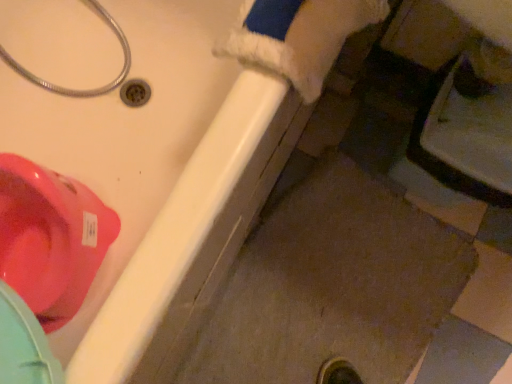
The height and width of the screenshot is (384, 512). Describe the element at coordinates (50, 238) in the screenshot. I see `glossy plastic toilet at upper left` at that location.

Find the location of a particular element. The width and height of the screenshot is (512, 384). matte white bathtub at lower left is located at coordinates (185, 240).

At what (x,y) coordinates should I click in order to perform the action: click on plumbing fixture in front of the glossy plastic toilet at upper left. Please return your answer as a coordinate pair (x, y). The width and height of the screenshot is (512, 384). Looking at the image, I should click on (80, 89).

How many degrees apart are the facing directions of glossy plastic toilet at upper left and metallic silver hose at upper left?

There is a 90.9-degree angle between the facing directions of glossy plastic toilet at upper left and metallic silver hose at upper left.

Looking at their sizes, would you say glossy plastic toilet at upper left is wider or thinner than metallic silver hose at upper left?

In the image, glossy plastic toilet at upper left appears to be more narrow than metallic silver hose at upper left.

Is glossy plastic toilet at upper left taller than metallic silver hose at upper left?

No, glossy plastic toilet at upper left is not taller than metallic silver hose at upper left.

Which object is more forward, matte white bathtub at lower left or glossy plastic toilet at upper left?

matte white bathtub at lower left is closer to the camera.

Does matte white bathtub at lower left turn towards glossy plastic toilet at upper left?

Yes, matte white bathtub at lower left is aimed at glossy plastic toilet at upper left.

Which is correct: matte white bathtub at lower left is inside glossy plastic toilet at upper left, or outside of it?

matte white bathtub at lower left is located beyond the bounds of glossy plastic toilet at upper left.

Which object is closer to the camera taking this photo, matte white bathtub at lower left or metallic silver hose at upper left?

Positioned in front is matte white bathtub at lower left.

I want to click on plumbing fixture above the matte white bathtub at lower left (from a real-world perspective), so click(x=80, y=89).

Is matte white bathtub at lower left located outside metallic silver hose at upper left?

Yes, matte white bathtub at lower left is not within metallic silver hose at upper left.

Does metallic silver hose at upper left have a larger size compared to glossy plastic toilet at upper left?

Yes, metallic silver hose at upper left is bigger than glossy plastic toilet at upper left.

Can you confirm if metallic silver hose at upper left is wider than glossy plastic toilet at upper left?

Correct, the width of metallic silver hose at upper left exceeds that of glossy plastic toilet at upper left.

Does metallic silver hose at upper left come behind glossy plastic toilet at upper left?

No, metallic silver hose at upper left is closer to the viewer.

Is glossy plastic toilet at upper left surrounded by metallic silver hose at upper left?

No, glossy plastic toilet at upper left is not inside metallic silver hose at upper left.

Measure the distance between glossy plastic toilet at upper left and matte white bathtub at lower left.

glossy plastic toilet at upper left is 10.62 inches away from matte white bathtub at lower left.

Is glossy plastic toilet at upper left not within matte white bathtub at lower left?

No, glossy plastic toilet at upper left is inside matte white bathtub at lower left's boundary.

Is glossy plastic toilet at upper left oriented towards matte white bathtub at lower left?

Yes, glossy plastic toilet at upper left faces towards matte white bathtub at lower left.

Consider the image. From a real-world perspective, which object rests below the other?

glossy plastic toilet at upper left is physically lower.

Is metallic silver hose at upper left facing towards matte white bathtub at lower left?

Yes.

This screenshot has height=384, width=512. I want to click on bath on the right side of metallic silver hose at upper left, so pos(185,240).

Is metallic silver hose at upper left not inside matte white bathtub at lower left?

Result: No, metallic silver hose at upper left is not entirely external to matte white bathtub at lower left.

From the image's perspective, is metallic silver hose at upper left above matte white bathtub at lower left?

Yes, from the image's perspective, metallic silver hose at upper left is over matte white bathtub at lower left.

Where is `toilet on the right of the metallic silver hose at upper left`? The height and width of the screenshot is (384, 512). toilet on the right of the metallic silver hose at upper left is located at coordinates (50, 238).

Identify the location of toilet that is under the matte white bathtub at lower left (from a real-world perspective). (50, 238).

When comparing their distances from metallic silver hose at upper left, does glossy plastic toilet at upper left or matte white bathtub at lower left seem further?

matte white bathtub at lower left.

Considering their positions, is metallic silver hose at upper left positioned further to matte white bathtub at lower left than glossy plastic toilet at upper left?

metallic silver hose at upper left lies further to matte white bathtub at lower left than the other object.

From the image, which object appears to be farther from glossy plastic toilet at upper left, metallic silver hose at upper left or matte white bathtub at lower left?

metallic silver hose at upper left lies further to glossy plastic toilet at upper left than the other object.

Considering their positions, is glossy plastic toilet at upper left positioned closer to matte white bathtub at lower left than metallic silver hose at upper left?

Among the two, glossy plastic toilet at upper left is located nearer to matte white bathtub at lower left.

Considering their positions, is matte white bathtub at lower left positioned closer to metallic silver hose at upper left than glossy plastic toilet at upper left?

glossy plastic toilet at upper left is positioned closer to the anchor metallic silver hose at upper left.

Which object lies nearer to the anchor point glossy plastic toilet at upper left, matte white bathtub at lower left or metallic silver hose at upper left?

matte white bathtub at lower left is closer to glossy plastic toilet at upper left.

Find the location of a particular element. bath between metallic silver hose at upper left and glossy plastic toilet at upper left in the vertical direction is located at coordinates (185, 240).